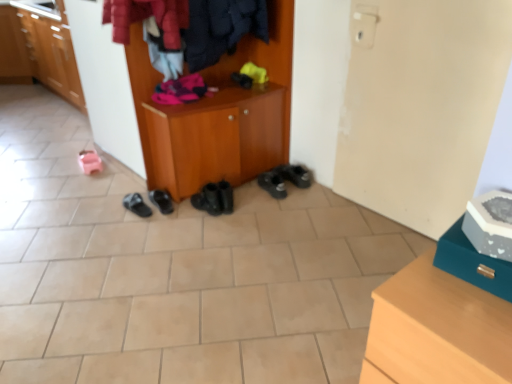
This screenshot has width=512, height=384. Find the location of `free space that is to the left of black rubber sandals at center, which appears as the second footwear when viewed from the left`. free space that is to the left of black rubber sandals at center, which appears as the second footwear when viewed from the left is located at coordinates (104, 208).